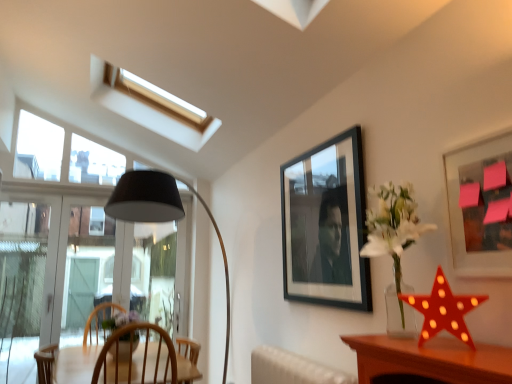
Question: Can you confirm if red plastic star at right is smaller than matte black picture frame at upper right, which is counted as the 1th picture frame, starting from the front?

Choices:
 (A) yes
 (B) no

Answer: (A)

Question: Does red plastic star at right have a larger size compared to matte black picture frame at upper right, which appears as the second picture frame when viewed from the back?

Choices:
 (A) no
 (B) yes

Answer: (A)

Question: Is red plastic star at right thinner than matte black picture frame at upper right, which is counted as the 1th picture frame, starting from the front?

Choices:
 (A) yes
 (B) no

Answer: (B)

Question: Is red plastic star at right surrounding matte black picture frame at upper right, positioned as the 1th picture frame in right-to-left order?

Choices:
 (A) no
 (B) yes

Answer: (A)

Question: Is red plastic star at right further to camera compared to matte black picture frame at upper right, which appears as the second picture frame when viewed from the back?

Choices:
 (A) yes
 (B) no

Answer: (A)

Question: Considering the relative sizes of red plastic star at right and matte black picture frame at upper right, which appears as the second picture frame when viewed from the back, in the image provided, is red plastic star at right wider than matte black picture frame at upper right, which appears as the second picture frame when viewed from the back,?

Choices:
 (A) no
 (B) yes

Answer: (B)

Question: Considering the relative sizes of matte black picture frame at upper right, which is counted as the 1th picture frame, starting from the front, and transparent glass window at left in the image provided, is matte black picture frame at upper right, which is counted as the 1th picture frame, starting from the front, thinner than transparent glass window at left?

Choices:
 (A) no
 (B) yes

Answer: (B)

Question: Would you say matte black picture frame at upper right, which appears as the second picture frame when viewed from the back, contains transparent glass window at left?

Choices:
 (A) no
 (B) yes

Answer: (A)

Question: From the image's perspective, would you say matte black picture frame at upper right, which appears as the second picture frame when viewed from the back, is shown under transparent glass window at left?

Choices:
 (A) no
 (B) yes

Answer: (A)

Question: Is matte black picture frame at upper right, positioned as the second picture frame in left-to-right order, wider than transparent glass window at left?

Choices:
 (A) yes
 (B) no

Answer: (B)

Question: Is the depth of matte black picture frame at upper right, positioned as the 1th picture frame in right-to-left order, greater than that of transparent glass window at left?

Choices:
 (A) yes
 (B) no

Answer: (B)

Question: Is matte black picture frame at upper right, which is counted as the 1th picture frame, starting from the front, aimed at transparent glass window at left?

Choices:
 (A) yes
 (B) no

Answer: (B)

Question: Is matte black picture frame at upper right, which is counted as the 1th picture frame, starting from the front, looking in the opposite direction of red plastic star at right?

Choices:
 (A) yes
 (B) no

Answer: (B)